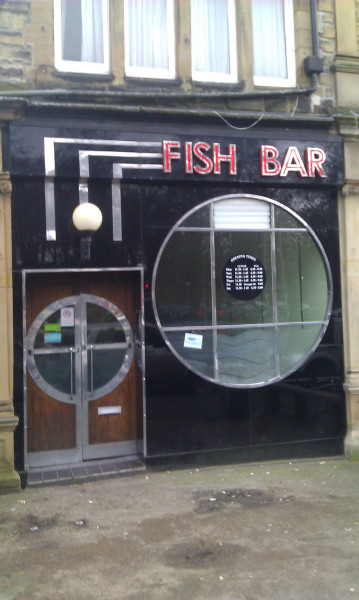
Identify the location of silver door trim. (57, 459).